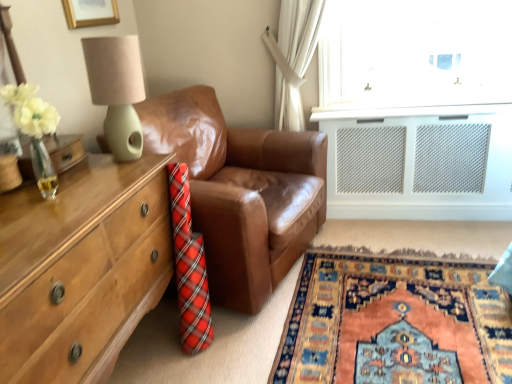
Question: From a real-world perspective, is carpet with intricate patterns at lower right physically located above or below wooden chest of drawers at left?

Choices:
 (A) above
 (B) below

Answer: (B)

Question: Visually, is carpet with intricate patterns at lower right positioned to the left or to the right of wooden chest of drawers at left?

Choices:
 (A) left
 (B) right

Answer: (B)

Question: Which object is the closest to the carpet with intricate patterns at lower right?

Choices:
 (A) wooden chest of drawers at left
 (B) brown leather couch at center
 (C) matte green lamp at upper left

Answer: (B)

Question: Estimate the real-world distances between objects in this image. Which object is farther from the matte green lamp at upper left?

Choices:
 (A) carpet with intricate patterns at lower right
 (B) brown leather couch at center
 (C) wooden chest of drawers at left

Answer: (A)